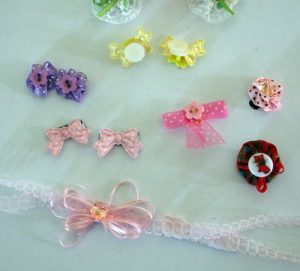
Find the location of a particular element. The height and width of the screenshot is (271, 300). table is located at coordinates (260, 44).